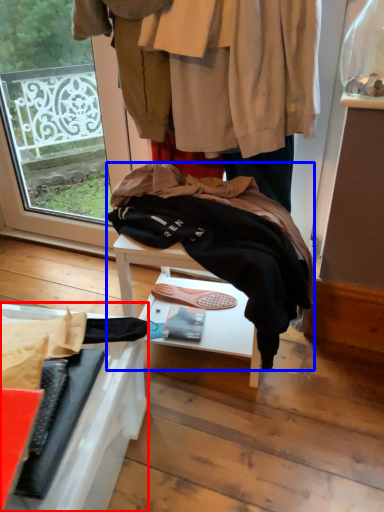
Question: Among these objects, which one is nearest to the camera, furniture (highlighted by a red box) or wool (highlighted by a blue box)?

Choices:
 (A) furniture
 (B) wool

Answer: (A)